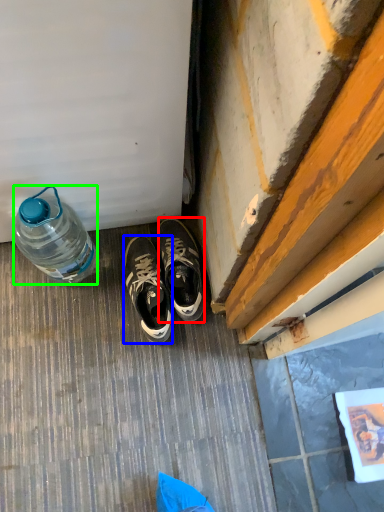
Question: Considering the real-world distances, which object is farthest from sneakers (highlighted by a red box)? sneakers (highlighted by a blue box) or bottle (highlighted by a green box)?

Choices:
 (A) sneakers
 (B) bottle

Answer: (B)